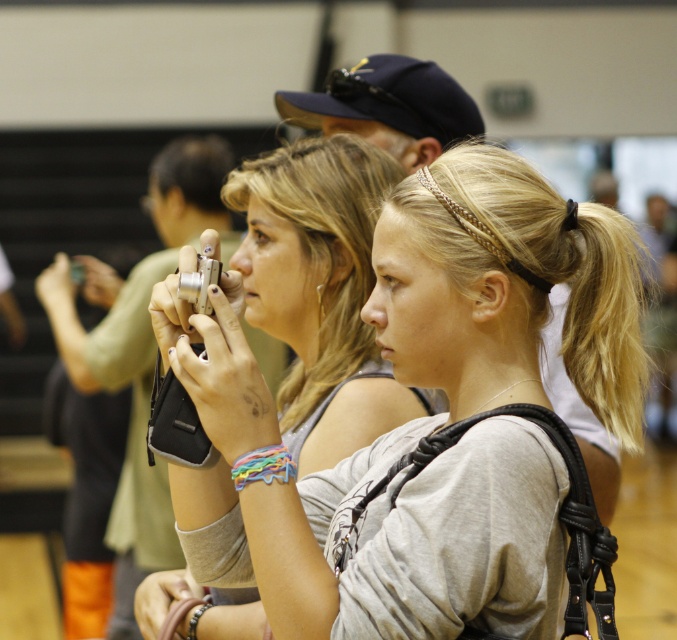
Locate an element on the screen. Image resolution: width=677 pixels, height=640 pixels. matte silver camera at center is located at coordinates (420, 420).

Is matte silver camera at center positioned behind silver metallic camera at center?

That is False.

Identify the location of matte silver camera at center. Image resolution: width=677 pixels, height=640 pixels. (420, 420).

The image size is (677, 640). In order to click on matte silver camera at center in this screenshot , I will do `click(420, 420)`.